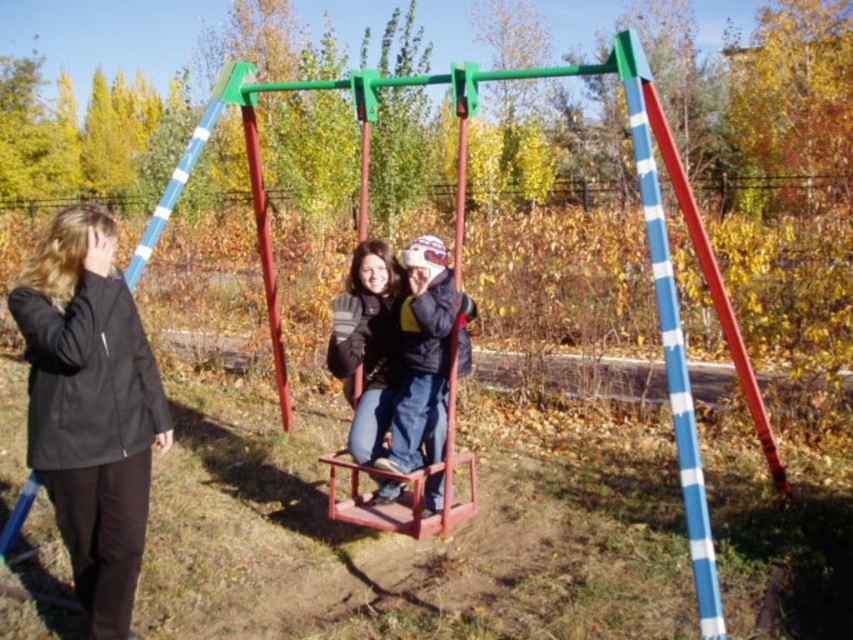
Does blue striped pole at right have a smaller size compared to metallic red swing at center?

Incorrect, blue striped pole at right is not smaller in size than metallic red swing at center.

Locate an element on the screen. blue striped pole at right is located at coordinates (670, 336).

Which is behind, point (643, 212) or point (471, 468)?

Point (643, 212)

Identify the location of blue striped pole at right. This screenshot has height=640, width=853. (670, 336).

Is black matte jacket at left behind velvet blue jacket at center?

No.

Measure the distance from black matte jacket at left to velvet blue jacket at center.

black matte jacket at left is 1.59 meters away from velvet blue jacket at center.

Locate an element on the screen. This screenshot has height=640, width=853. black matte jacket at left is located at coordinates (90, 408).

Does point (427, 387) come closer to viewer compared to point (329, 477)?

Yes, it is in front of point (329, 477).

Which is in front, point (404, 380) or point (418, 483)?

Point (418, 483)

Measure the distance between point (437,460) and camera.

The distance of point (437,460) from camera is 4.58 meters.

This screenshot has height=640, width=853. Identify the location of velvet blue jacket at center. (424, 356).